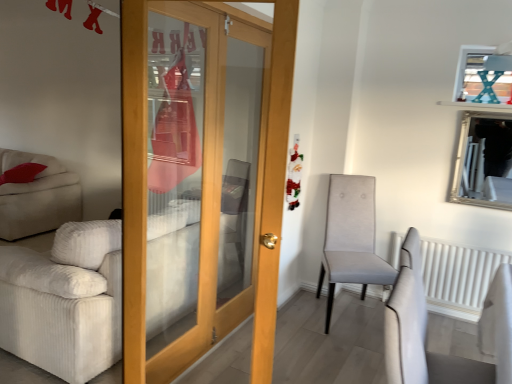
Question: From a real-world perspective, does wooden door at center stand above silver/glass mirror at upper right?

Choices:
 (A) no
 (B) yes

Answer: (A)

Question: Does wooden door at center appear on the right side of silver/glass mirror at upper right?

Choices:
 (A) yes
 (B) no

Answer: (B)

Question: Considering the relative sizes of wooden door at center and silver/glass mirror at upper right in the image provided, is wooden door at center taller than silver/glass mirror at upper right?

Choices:
 (A) no
 (B) yes

Answer: (B)

Question: Is the depth of wooden door at center less than that of silver/glass mirror at upper right?

Choices:
 (A) no
 (B) yes

Answer: (B)

Question: Considering the relative sizes of wooden door at center and silver/glass mirror at upper right in the image provided, is wooden door at center wider than silver/glass mirror at upper right?

Choices:
 (A) no
 (B) yes

Answer: (B)

Question: Considering their positions, is white corduroy couch at left located in front of or behind light gray fabric chair at center-right?

Choices:
 (A) behind
 (B) front

Answer: (B)

Question: Considering the positions of white corduroy couch at left and light gray fabric chair at center-right in the image, is white corduroy couch at left bigger or smaller than light gray fabric chair at center-right?

Choices:
 (A) small
 (B) big

Answer: (B)

Question: Based on their positions, is white corduroy couch at left located to the left or right of light gray fabric chair at center-right?

Choices:
 (A) right
 (B) left

Answer: (B)

Question: Which is correct: white corduroy couch at left is inside light gray fabric chair at center-right, or outside of it?

Choices:
 (A) inside
 (B) outside

Answer: (B)

Question: Considering their positions, is white textured radiator at right located in front of or behind silver/glass mirror at upper right?

Choices:
 (A) behind
 (B) front

Answer: (A)

Question: From a real-world perspective, relative to silver/glass mirror at upper right, is white textured radiator at right vertically above or below?

Choices:
 (A) above
 (B) below

Answer: (B)

Question: In terms of size, does white textured radiator at right appear bigger or smaller than silver/glass mirror at upper right?

Choices:
 (A) small
 (B) big

Answer: (B)

Question: Is white textured radiator at right to the left or to the right of silver/glass mirror at upper right in the image?

Choices:
 (A) right
 (B) left

Answer: (B)

Question: Does point (428, 248) appear closer or farther from the camera than point (139, 195)?

Choices:
 (A) closer
 (B) farther

Answer: (B)

Question: Is white textured radiator at right taller or shorter than wooden door at center?

Choices:
 (A) tall
 (B) short

Answer: (B)